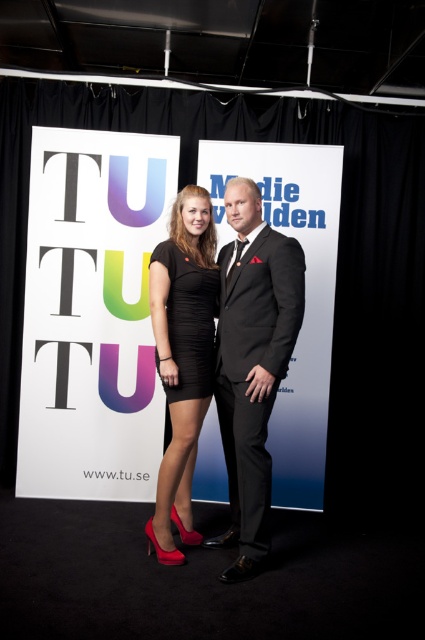
Question: Among these points, which one is farthest from the camera?

Choices:
 (A) (246, 467)
 (B) (195, 378)
 (C) (190, 400)

Answer: (B)

Question: Estimate the real-world distances between objects in this image. Which object is farther from the matte black dress at center?

Choices:
 (A) black satin suit at center
 (B) black matte dress at center

Answer: (A)

Question: Is black satin suit at center in front of black matte dress at center?

Choices:
 (A) no
 (B) yes

Answer: (B)

Question: Which point appears closest to the camera in this image?

Choices:
 (A) (241, 518)
 (B) (192, 412)
 (C) (201, 392)

Answer: (A)

Question: Is black satin suit at center above black matte dress at center?

Choices:
 (A) yes
 (B) no

Answer: (B)

Question: Does black satin suit at center have a greater width compared to matte black dress at center?

Choices:
 (A) no
 (B) yes

Answer: (B)